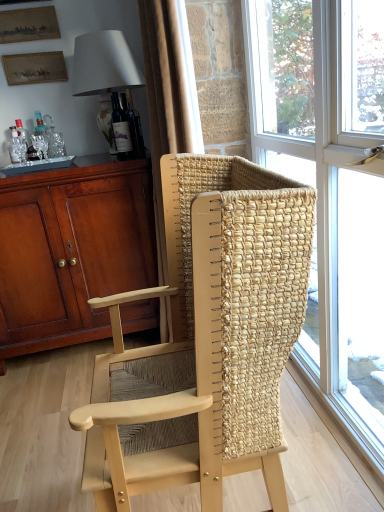
Question: Can you confirm if translucent glass window at center is positioned to the right of white fabric lampshade at upper left?

Choices:
 (A) yes
 (B) no

Answer: (A)

Question: From the image's perspective, is translucent glass window at center under white fabric lampshade at upper left?

Choices:
 (A) no
 (B) yes

Answer: (B)

Question: Could you tell me if translucent glass window at center is turned towards white fabric lampshade at upper left?

Choices:
 (A) yes
 (B) no

Answer: (B)

Question: Is the position of translucent glass window at center more distant than that of white fabric lampshade at upper left?

Choices:
 (A) no
 (B) yes

Answer: (A)

Question: Can you confirm if translucent glass window at center is shorter than white fabric lampshade at upper left?

Choices:
 (A) no
 (B) yes

Answer: (A)

Question: From the image's perspective, is translucent glass window at center on white fabric lampshade at upper left?

Choices:
 (A) yes
 (B) no

Answer: (B)

Question: From the image's perspective, is matte brown cabinet at left over white fabric lampshade at upper left?

Choices:
 (A) yes
 (B) no

Answer: (B)

Question: Is matte brown cabinet at left bigger than white fabric lampshade at upper left?

Choices:
 (A) yes
 (B) no

Answer: (A)

Question: From a real-world perspective, is matte brown cabinet at left on white fabric lampshade at upper left?

Choices:
 (A) no
 (B) yes

Answer: (A)

Question: Can you confirm if matte brown cabinet at left is wider than white fabric lampshade at upper left?

Choices:
 (A) no
 (B) yes

Answer: (B)

Question: Is white fabric lampshade at upper left located within matte brown cabinet at left?

Choices:
 (A) yes
 (B) no

Answer: (B)

Question: Could you tell me if matte brown cabinet at left is facing white fabric lampshade at upper left?

Choices:
 (A) no
 (B) yes

Answer: (A)

Question: From a real-world perspective, is wooden picture frame at upper left, placed as the first picture frame when sorted from top to bottom, located higher than matte gold picture frame at upper left, which appears as the second picture frame when ordered from the bottom?

Choices:
 (A) yes
 (B) no

Answer: (A)